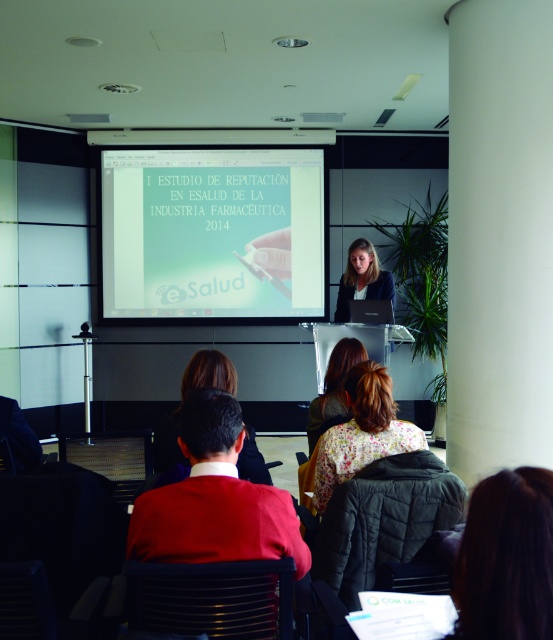
Locate an element on the screen. Image resolution: width=553 pixels, height=640 pixels. white glossy projector screen at center is located at coordinates (212, 232).

Can you confirm if white glossy projector screen at center is positioned to the right of floral fabric dress at center?

Incorrect, white glossy projector screen at center is not on the right side of floral fabric dress at center.

Is point (153, 310) less distant than point (338, 413)?

No, (153, 310) is behind (338, 413).

In order to click on white glossy projector screen at center in this screenshot , I will do coord(212,232).

Between floral fabric jacket at center and dark brown hair at center, which one is positioned lower?

floral fabric jacket at center is lower down.

How far apart are floral fabric jacket at center and dark brown hair at center?

They are 52.92 centimeters apart.

At what (x,y) coordinates should I click in order to perform the action: click on floral fabric jacket at center. Please return your answer as a coordinate pair (x, y). The width and height of the screenshot is (553, 640). Looking at the image, I should click on (362, 432).

I want to click on floral fabric jacket at center, so click(362, 432).

The width and height of the screenshot is (553, 640). I want to click on floral fabric dress at center, so click(333, 388).

Between point (327, 428) and point (368, 252), which one is positioned in front?

Positioned in front is point (327, 428).

The height and width of the screenshot is (640, 553). In order to click on floral fabric dress at center in this screenshot , I will do `click(333, 388)`.